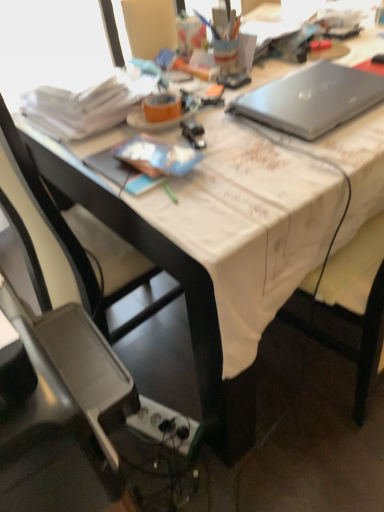
I want to click on free spot in front of metallic silver stapler at center, so click(x=223, y=176).